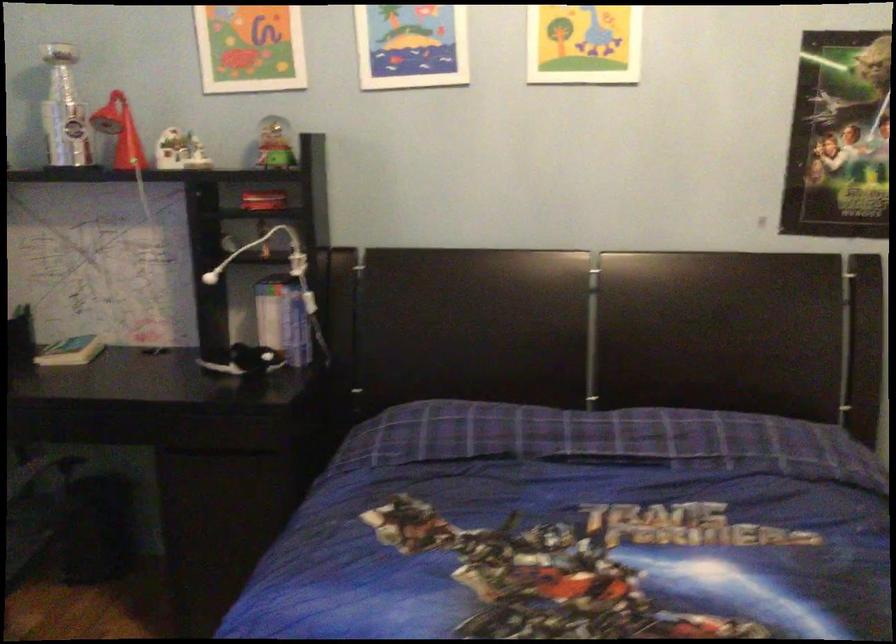
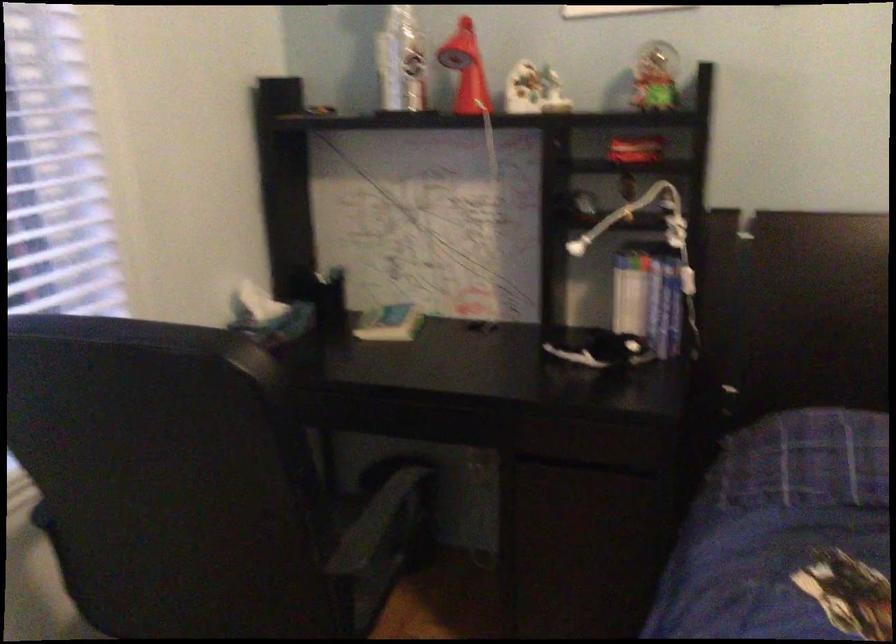
Where in the second image is the point corresponding to [273,140] from the first image?

(655, 77)